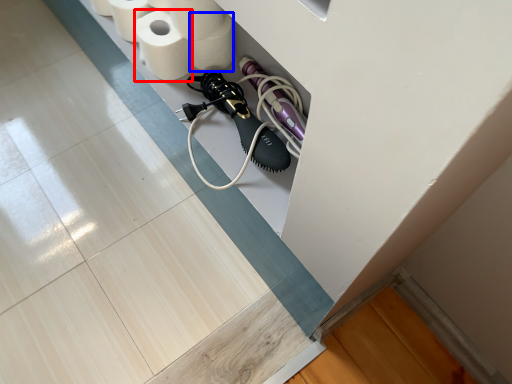
Question: Among these objects, which one is farthest to the camera, toilet paper (highlighted by a red box) or toilet paper (highlighted by a blue box)?

Choices:
 (A) toilet paper
 (B) toilet paper

Answer: (B)